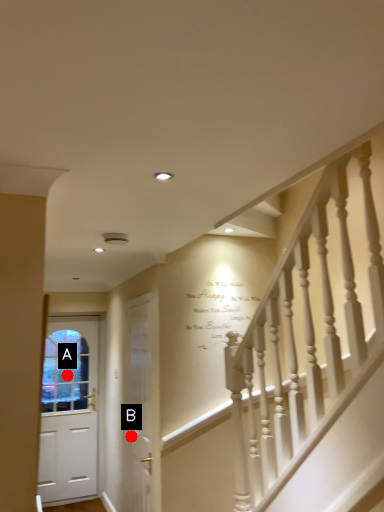
Question: Two points are circled on the image, labeled by A and B beside each circle. Which point is farther from the camera taking this photo?

Choices:
 (A) A is further
 (B) B is further

Answer: (A)